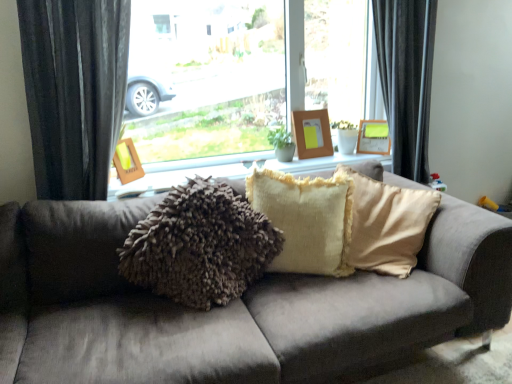
Describe the element at coordinates (74, 91) in the screenshot. The height and width of the screenshot is (384, 512). I see `velvet dark gray curtain at left` at that location.

Where is `velvet brown couch at center`? velvet brown couch at center is located at coordinates (231, 305).

This screenshot has width=512, height=384. In order to click on fuzzy fabric pillows at center in this screenshot , I will do `click(229, 171)`.

Which of these two, wooden picture frame at upper center, the third picture frame in the left-to-right sequence, or fuzzy fabric pillows at center, is wider?

fuzzy fabric pillows at center is wider.

Does wooden picture frame at upper center, positioned as the first picture frame in right-to-left order, have a larger size compared to fuzzy fabric pillows at center?

Incorrect, wooden picture frame at upper center, positioned as the first picture frame in right-to-left order, is not larger than fuzzy fabric pillows at center.

Is there a large distance between wooden picture frame at upper center, positioned as the first picture frame in right-to-left order, and fuzzy fabric pillows at center?

No, wooden picture frame at upper center, positioned as the first picture frame in right-to-left order, is not far away from fuzzy fabric pillows at center.

Which object is positioned more to the left, wooden picture frame at upper center, positioned as the 1th picture frame in back-to-front order, or fuzzy fabric pillows at center?

fuzzy fabric pillows at center.

Based on the photo, can you confirm if velvet brown couch at center is thinner than wooden frame at center, positioned as the 2th picture frame in front-to-back order?

Incorrect, the width of velvet brown couch at center is not less than that of wooden frame at center, positioned as the 2th picture frame in front-to-back order.

Considering the sizes of velvet brown couch at center and wooden frame at center, acting as the second picture frame starting from the left, in the image, is velvet brown couch at center bigger or smaller than wooden frame at center, acting as the second picture frame starting from the left,?

Clearly, velvet brown couch at center is larger in size than wooden frame at center, acting as the second picture frame starting from the left.

From the picture: Is velvet brown couch at center in front of or behind wooden frame at center, acting as the second picture frame starting from the left, in the image?

Visually, velvet brown couch at center is located in front of wooden frame at center, acting as the second picture frame starting from the left.

Could you tell me if velvet brown couch at center is facing wooden frame at center, acting as the second picture frame starting from the left?

No, velvet brown couch at center is not oriented towards wooden frame at center, acting as the second picture frame starting from the left.

Looking at this image, in terms of width, does woodenwoodenpicture frame at left, the third picture frame viewed from the back, look wider or thinner when compared to transparent glass window at center?

Clearly, woodenwoodenpicture frame at left, the third picture frame viewed from the back, has less width compared to transparent glass window at center.

How many degrees apart are the facing directions of woodenwoodenpicture frame at left, the third picture frame from the right, and transparent glass window at center?

43.7 degrees separate the facing orientations of woodenwoodenpicture frame at left, the third picture frame from the right, and transparent glass window at center.

Is transparent glass window at center at the back of woodenwoodenpicture frame at left, the third picture frame viewed from the back?

Yes.

From the image's perspective, is woodenwoodenpicture frame at left, the first picture frame positioned from the front, beneath transparent glass window at center?

Yes, from the image's perspective, woodenwoodenpicture frame at left, the first picture frame positioned from the front, is beneath transparent glass window at center.

Is velvet brown couch at center oriented towards woodenwoodenpicture frame at left, the third picture frame viewed from the back?

No, velvet brown couch at center does not turn towards woodenwoodenpicture frame at left, the third picture frame viewed from the back.

Who is bigger, velvet brown couch at center or woodenwoodenpicture frame at left, the third picture frame viewed from the back?

velvet brown couch at center.

From the picture: Is velvet brown couch at center directly adjacent to woodenwoodenpicture frame at left, the third picture frame viewed from the back?

No.

Which object is thinner, velvet brown couch at center or woodenwoodenpicture frame at left, the third picture frame viewed from the back?

woodenwoodenpicture frame at left, the third picture frame viewed from the back, is thinner.

How many degrees apart are the facing directions of wooden frame at center, which is the 2th picture frame in back-to-front order, and velvet brown couch at center?

wooden frame at center, which is the 2th picture frame in back-to-front order, and velvet brown couch at center are facing 1.26e-05 degrees away from each other.

Can you confirm if wooden frame at center, which is the 2th picture frame in back-to-front order, is smaller than velvet brown couch at center?

Indeed, wooden frame at center, which is the 2th picture frame in back-to-front order, has a smaller size compared to velvet brown couch at center.

From a real-world perspective, is wooden frame at center, acting as the second picture frame starting from the left, on top of velvet brown couch at center?

Indeed, from a real-world perspective, wooden frame at center, acting as the second picture frame starting from the left, stands above velvet brown couch at center.

Is the position of wooden frame at center, the second picture frame positioned from the right, less distant than that of velvet brown couch at center?

No, wooden frame at center, the second picture frame positioned from the right, is behind velvet brown couch at center.

Is fuzzy fabric pillows at center not near velvet dark gray curtain at left?

No, there isn't a large distance between fuzzy fabric pillows at center and velvet dark gray curtain at left.

Is fuzzy fabric pillows at center spatially inside velvet dark gray curtain at left, or outside of it?

The correct answer is: outside.

Does fuzzy fabric pillows at center have a greater height compared to velvet dark gray curtain at left?

No, fuzzy fabric pillows at center is not taller than velvet dark gray curtain at left.

Is fuzzy fabric pillows at center facing away from velvet dark gray curtain at left?

fuzzy fabric pillows at center is not turned away from velvet dark gray curtain at left.

Identify the location of pillow directly beneath the woodenwoodenpicture frame at left, which appears as the 1th picture frame when viewed from the left (from a real-world perspective). This screenshot has height=384, width=512. (306, 219).

Which of these two, fuzzy beige pillow at center or woodenwoodenpicture frame at left, the third picture frame from the right, is wider?

fuzzy beige pillow at center is wider.

Does fuzzy beige pillow at center have a greater height compared to woodenwoodenpicture frame at left, which appears as the 1th picture frame when viewed from the left?

Indeed, fuzzy beige pillow at center has a greater height compared to woodenwoodenpicture frame at left, which appears as the 1th picture frame when viewed from the left.

Which object is closer to the camera, fuzzy beige pillow at center or woodenwoodenpicture frame at left, which appears as the 1th picture frame when viewed from the left?

fuzzy beige pillow at center is more forward.

What are the coordinates of `the 1st picture frame directly above the fuzzy fabric pillows at center (from a real-world perspective)` in the screenshot? It's located at (373, 137).

Locate an element on the screen. the 1st picture frame to the right when counting from the velvet brown couch at center is located at coordinates (312, 133).

Which object lies further to the anchor point transparent glass window at center, fuzzy fabric pillows at center or wooden frame at center, which is the 2th picture frame in back-to-front order?

Based on the image, wooden frame at center, which is the 2th picture frame in back-to-front order, appears to be further to transparent glass window at center.

From the image, which object appears to be nearer to transparent glass window at center, wooden frame at center, the second picture frame positioned from the right, or velvet brown couch at center?

Based on the image, velvet brown couch at center appears to be nearer to transparent glass window at center.

Consider the image. Based on their spatial positions, is wooden picture frame at upper center, positioned as the 1th picture frame in back-to-front order, or fuzzy beige pillow at center further from transparent glass window at center?

wooden picture frame at upper center, positioned as the 1th picture frame in back-to-front order, is further to transparent glass window at center.

Estimate the real-world distances between objects in this image. Which object is closer to wooden picture frame at upper center, the third picture frame in the left-to-right sequence, fuzzy fabric pillows at center or transparent glass window at center?

fuzzy fabric pillows at center is closer to wooden picture frame at upper center, the third picture frame in the left-to-right sequence.

Looking at the image, which one is located closer to transparent glass window at center, woodenwoodenpicture frame at left, the third picture frame viewed from the back, or wooden picture frame at upper center, the third picture frame in the left-to-right sequence?

The object closer to transparent glass window at center is woodenwoodenpicture frame at left, the third picture frame viewed from the back.

Considering their positions, is fuzzy fabric pillows at center positioned further to transparent glass window at center than fuzzy beige pillow at center?

Among the two, fuzzy beige pillow at center is located further to transparent glass window at center.

Looking at the image, which one is located further to wooden frame at center, the second picture frame positioned from the right, velvet brown couch at center or fuzzy fabric pillows at center?

Among the two, velvet brown couch at center is located further to wooden frame at center, the second picture frame positioned from the right.

Estimate the real-world distances between objects in this image. Which object is further from fuzzy beige pillow at center, wooden frame at center, acting as the second picture frame starting from the left, or velvet dark gray curtain at left?

velvet dark gray curtain at left lies further to fuzzy beige pillow at center than the other object.

You are a GUI agent. You are given a task and a screenshot of the screen. Output one action in this format:
    pyautogui.click(x=<x>, y=<y>)
    Task: Click on the curtain located between velvet brown couch at center and transparent glass window at center in the depth direction
    
    Given the screenshot: What is the action you would take?
    pyautogui.click(x=74, y=91)

At what (x,y) coordinates should I click in order to perform the action: click on window located between velvet brown couch at center and wooden frame at center, the second picture frame positioned from the right, in the depth direction. Please return your answer as a coordinate pair (x, y). Image resolution: width=512 pixels, height=384 pixels. Looking at the image, I should click on (73, 90).

At what (x,y) coordinates should I click in order to perform the action: click on window situated between velvet dark gray curtain at left and fuzzy beige pillow at center from left to right. Please return your answer as a coordinate pair (x, y). Looking at the image, I should click on (73, 90).

Locate an element on the screen. window sill between velvet dark gray curtain at left and fuzzy beige pillow at center from left to right is located at coordinates (229, 171).